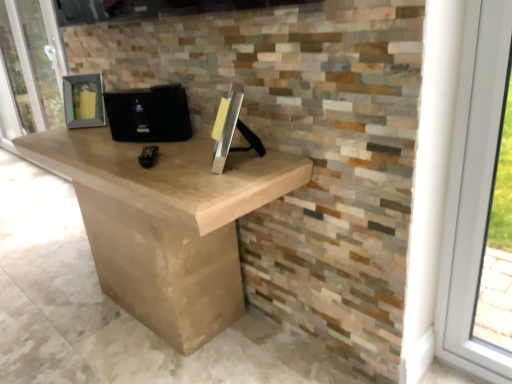
Question: Is matte gray frame at left outside black matte speaker at center?

Choices:
 (A) yes
 (B) no

Answer: (A)

Question: Can you confirm if matte gray frame at left is taller than black matte speaker at center?

Choices:
 (A) yes
 (B) no

Answer: (A)

Question: Could black matte speaker at center be considered to be inside matte gray frame at left?

Choices:
 (A) no
 (B) yes

Answer: (A)

Question: Can you confirm if matte gray frame at left is shorter than black matte speaker at center?

Choices:
 (A) yes
 (B) no

Answer: (B)

Question: Is matte gray frame at left further to the viewer compared to black matte speaker at center?

Choices:
 (A) no
 (B) yes

Answer: (B)

Question: From the image's perspective, is matte gray frame at left over black matte speaker at center?

Choices:
 (A) yes
 (B) no

Answer: (A)

Question: From a real-world perspective, is black matte speaker at center on top of matte gray frame at left?

Choices:
 (A) no
 (B) yes

Answer: (B)

Question: Is black matte speaker at center bigger than matte gray frame at left?

Choices:
 (A) yes
 (B) no

Answer: (B)

Question: Does black matte speaker at center have a lesser width compared to matte gray frame at left?

Choices:
 (A) no
 (B) yes

Answer: (A)

Question: Is black matte speaker at center aimed at matte gray frame at left?

Choices:
 (A) yes
 (B) no

Answer: (B)

Question: From a real-world perspective, is black matte speaker at center positioned under matte gray frame at left based on gravity?

Choices:
 (A) yes
 (B) no

Answer: (B)

Question: From the image's perspective, is black matte speaker at center on matte gray frame at left?

Choices:
 (A) no
 (B) yes

Answer: (A)

Question: From the image's perspective, is matte gray frame at left positioned above or below black matte speaker at center?

Choices:
 (A) above
 (B) below

Answer: (A)